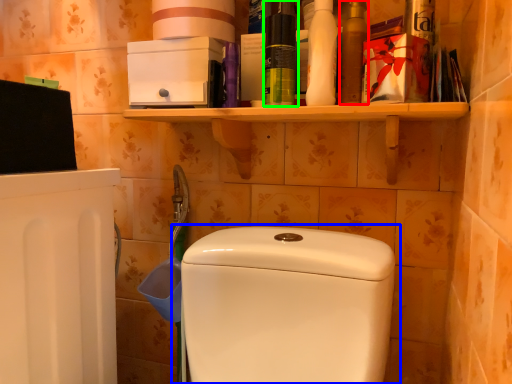
Question: Which is farther away from mouthwash (highlighted by a red box)? toilet (highlighted by a blue box) or cleaning product (highlighted by a green box)?

Choices:
 (A) toilet
 (B) cleaning product

Answer: (A)